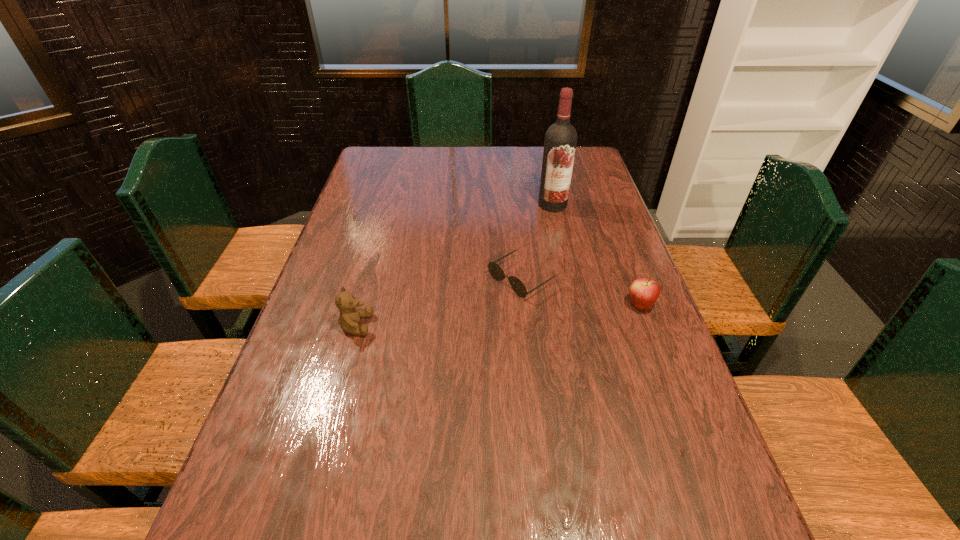
Image resolution: width=960 pixels, height=540 pixels. In order to click on vacant spot on the desktop that is between the leftmost object and the apple and is positioned on the label of the tallest object in this screenshot , I will do `click(540, 312)`.

Where is `free space on the desktop that is between the teddy bear and the rightmost object and is positioned on the front-facing side of the sunglasses`? This screenshot has height=540, width=960. free space on the desktop that is between the teddy bear and the rightmost object and is positioned on the front-facing side of the sunglasses is located at coordinates (458, 318).